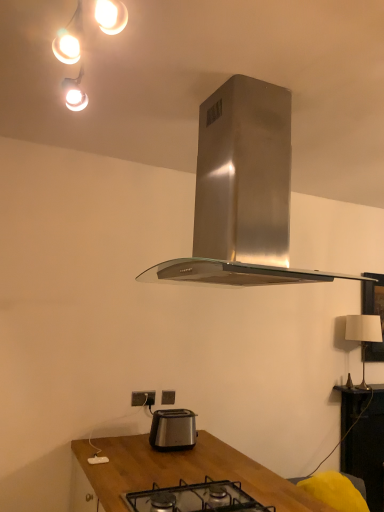
Question: Would you consider stainless steel range hood at center to be distant from white plastic power plugs and sockets at lower center, the first power plugs and sockets from the front?

Choices:
 (A) no
 (B) yes

Answer: (B)

Question: From the image's perspective, is stainless steel range hood at center on white plastic power plugs and sockets at lower center, which is counted as the 2th power plugs and sockets, starting from the back?

Choices:
 (A) yes
 (B) no

Answer: (A)

Question: Does stainless steel range hood at center have a larger size compared to white plastic power plugs and sockets at lower center, the 2th power plugs and sockets in the right-to-left sequence?

Choices:
 (A) yes
 (B) no

Answer: (A)

Question: Is stainless steel range hood at center to the right of white plastic power plugs and sockets at lower center, the 2th power plugs and sockets in the right-to-left sequence, from the viewer's perspective?

Choices:
 (A) no
 (B) yes

Answer: (B)

Question: Does stainless steel range hood at center contain white plastic power plugs and sockets at lower center, which is counted as the 2th power plugs and sockets, starting from the back?

Choices:
 (A) no
 (B) yes

Answer: (A)

Question: Based on their sizes in the image, would you say satin silver toaster at lower center is bigger or smaller than white fabric lampshade at right?

Choices:
 (A) big
 (B) small

Answer: (B)

Question: From a real-world perspective, relative to white fabric lampshade at right, is satin silver toaster at lower center vertically above or below?

Choices:
 (A) below
 (B) above

Answer: (A)

Question: From the image's perspective, is satin silver toaster at lower center positioned above or below white fabric lampshade at right?

Choices:
 (A) below
 (B) above

Answer: (A)

Question: From their relative heights in the image, would you say satin silver toaster at lower center is taller or shorter than white fabric lampshade at right?

Choices:
 (A) tall
 (B) short

Answer: (B)

Question: Choose the correct answer: Is satin silver power plugs and sockets at lower center, the second power plugs and sockets positioned from the front, inside white plastic power plugs and sockets at lower center, the first power plugs and sockets from the front, or outside it?

Choices:
 (A) outside
 (B) inside

Answer: (A)

Question: Is satin silver power plugs and sockets at lower center, the second power plugs and sockets positioned from the front, wider or thinner than white plastic power plugs and sockets at lower center, acting as the first power plugs and sockets starting from the left?

Choices:
 (A) wide
 (B) thin

Answer: (B)

Question: Looking at the image, does satin silver power plugs and sockets at lower center, the second power plugs and sockets positioned from the front, seem bigger or smaller compared to white plastic power plugs and sockets at lower center, which is counted as the 2th power plugs and sockets, starting from the back?

Choices:
 (A) small
 (B) big

Answer: (A)

Question: Is point (163, 394) closer or farther from the camera than point (147, 396)?

Choices:
 (A) closer
 (B) farther

Answer: (B)

Question: Relative to black glass gas stove at center, is white fabric lampshade at right in front or behind?

Choices:
 (A) behind
 (B) front

Answer: (A)

Question: In terms of height, does white fabric lampshade at right look taller or shorter compared to black glass gas stove at center?

Choices:
 (A) tall
 (B) short

Answer: (A)